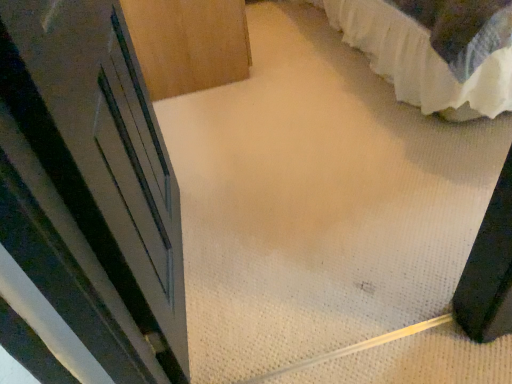
What is the approximate height of metallic gray door at left?

metallic gray door at left is 86.90 centimeters tall.

Identify the location of metallic gray door at left. The image size is (512, 384). (91, 186).

This screenshot has height=384, width=512. Describe the element at coordinates (91, 186) in the screenshot. I see `metallic gray door at left` at that location.

At what (x,y) coordinates should I click in order to perform the action: click on metallic gray door at left. Please return your answer as a coordinate pair (x, y). Looking at the image, I should click on (91, 186).